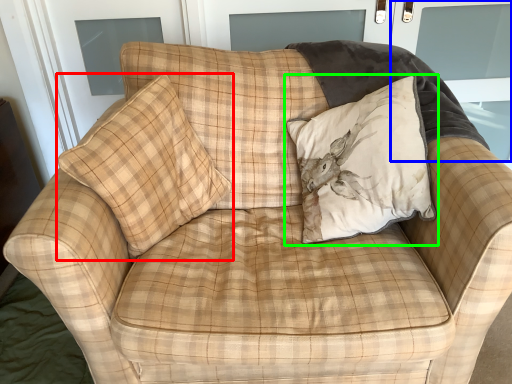
Question: Which object is positioned closest to pillow (highlighted by a red box)? Select from screen door (highlighted by a blue box) and pillow (highlighted by a green box).

Choices:
 (A) screen door
 (B) pillow

Answer: (B)